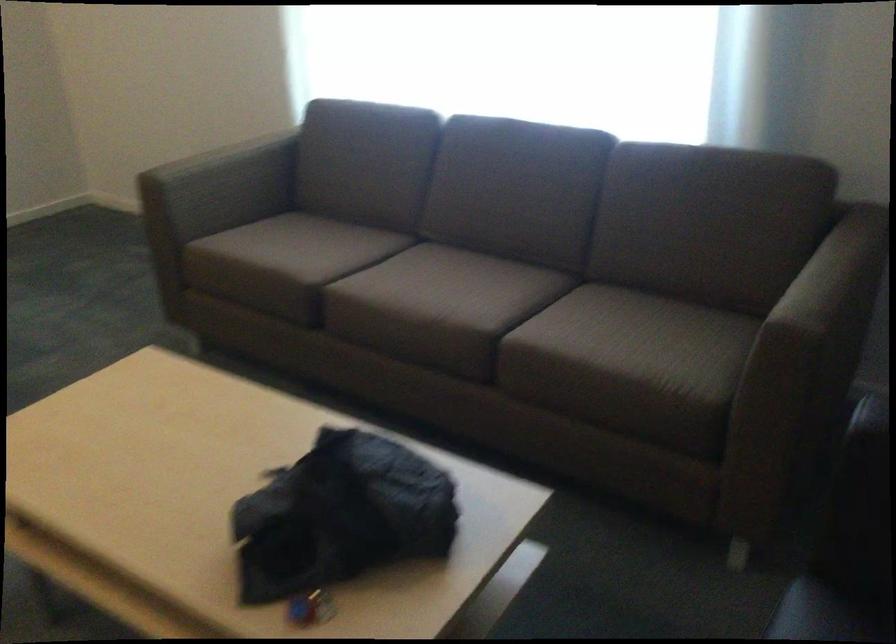
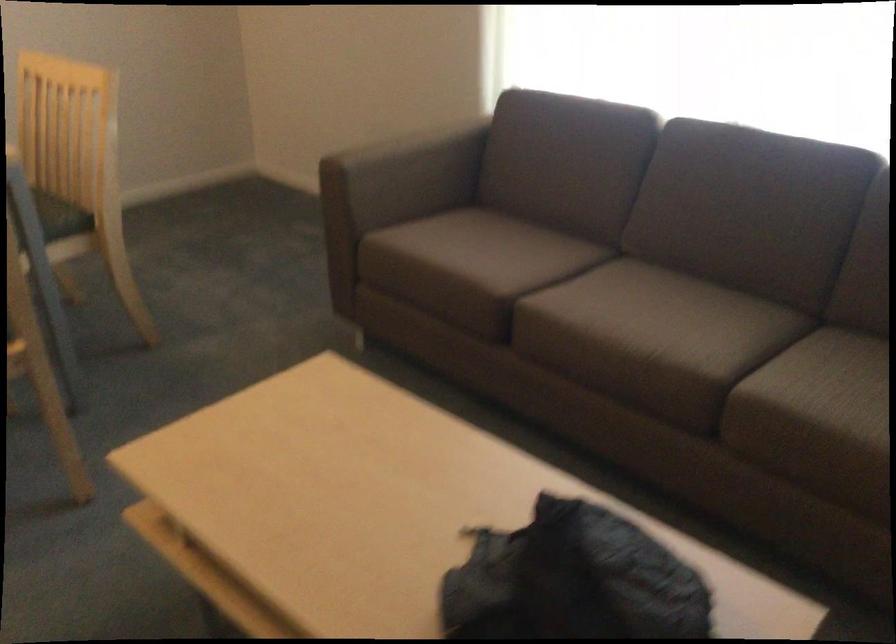
Which direction would the cameraman need to move to produce the second image?

The cameraman moved toward left, forward.